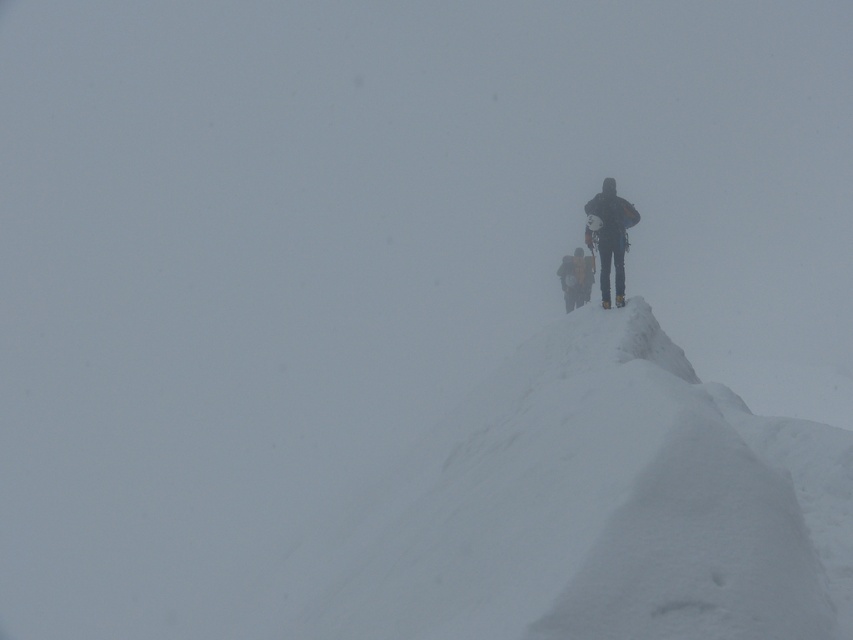
Which of these two, white snow at center or yellow fabric backpack at center, stands taller?

white snow at center

Can you confirm if white snow at center is smaller than yellow fabric backpack at center?

Incorrect, white snow at center is not smaller in size than yellow fabric backpack at center.

Find the location of `white snow at center`. white snow at center is located at coordinates (608, 508).

How much distance is there between white snow at center and dark blue fabric jacket at upper right?

white snow at center and dark blue fabric jacket at upper right are 4.94 meters apart.

Describe the element at coordinates (608, 508) in the screenshot. I see `white snow at center` at that location.

The image size is (853, 640). In order to click on white snow at center in this screenshot , I will do `click(608, 508)`.

Does dark blue fabric jacket at upper right have a lesser height compared to yellow fabric backpack at center?

Incorrect, dark blue fabric jacket at upper right's height does not fall short of yellow fabric backpack at center's.

Can you confirm if dark blue fabric jacket at upper right is positioned to the left of yellow fabric backpack at center?

Incorrect, dark blue fabric jacket at upper right is not on the left side of yellow fabric backpack at center.

Where is `dark blue fabric jacket at upper right`? dark blue fabric jacket at upper right is located at coordinates (608, 236).